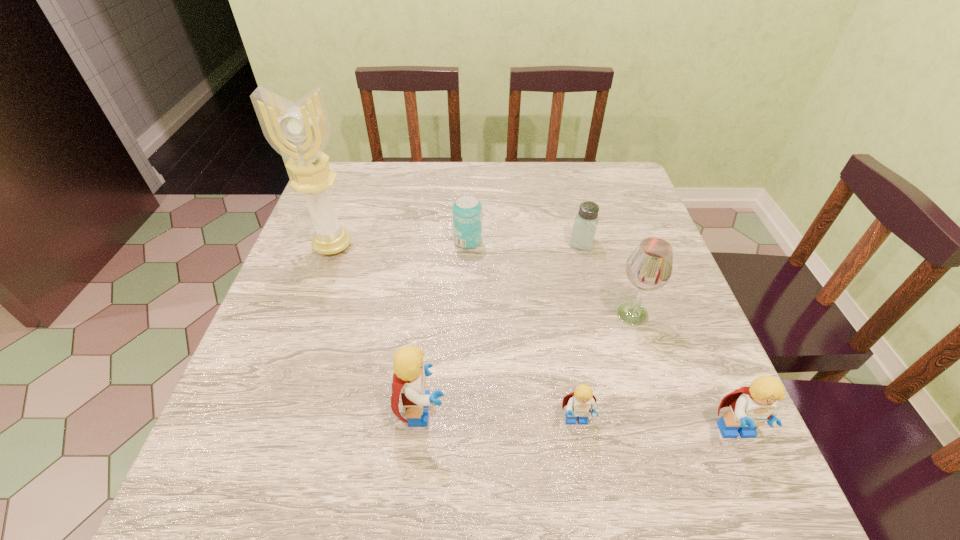
Image resolution: width=960 pixels, height=540 pixels. I want to click on free spot located 0.280m on the front-facing side of the leftmost Lego, so click(605, 410).

The width and height of the screenshot is (960, 540). What are the coordinates of `vacant space located on the left of the saltshaker` in the screenshot? It's located at (540, 242).

Find the location of a particular element. The width and height of the screenshot is (960, 540). blank space located on the front of the beer can is located at coordinates (466, 319).

Image resolution: width=960 pixels, height=540 pixels. Identify the location of vacant area situated on the front-facing side of the leftmost object. (313, 301).

At what (x,y) coordinates should I click in order to perform the action: click on vacant space located 0.230m on the front of the wineglass. Please return your answer as a coordinate pair (x, y). This screenshot has width=960, height=540. Looking at the image, I should click on (671, 436).

Find the location of `object positioned at the left edge`. object positioned at the left edge is located at coordinates (300, 131).

I want to click on Lego at the right edge, so click(750, 407).

Locate an element on the screen. saltshaker located in the right edge section of the desktop is located at coordinates (585, 225).

Where is `wineglass located at the right edge`? Image resolution: width=960 pixels, height=540 pixels. wineglass located at the right edge is located at coordinates (649, 267).

I want to click on object that is at the near right corner, so click(750, 407).